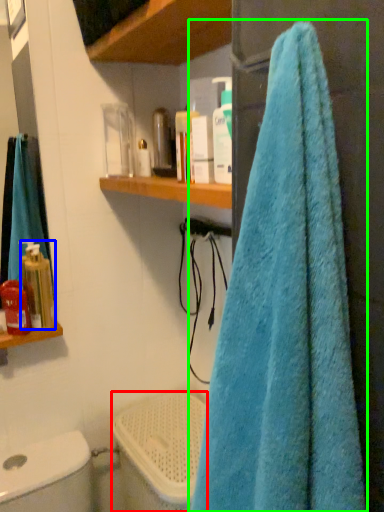
Question: Based on their relative distances, which object is farther from toilet bowl (highlighted by a red box)? Choose from toiletry (highlighted by a blue box) and towel (highlighted by a green box).

Choices:
 (A) toiletry
 (B) towel

Answer: (B)